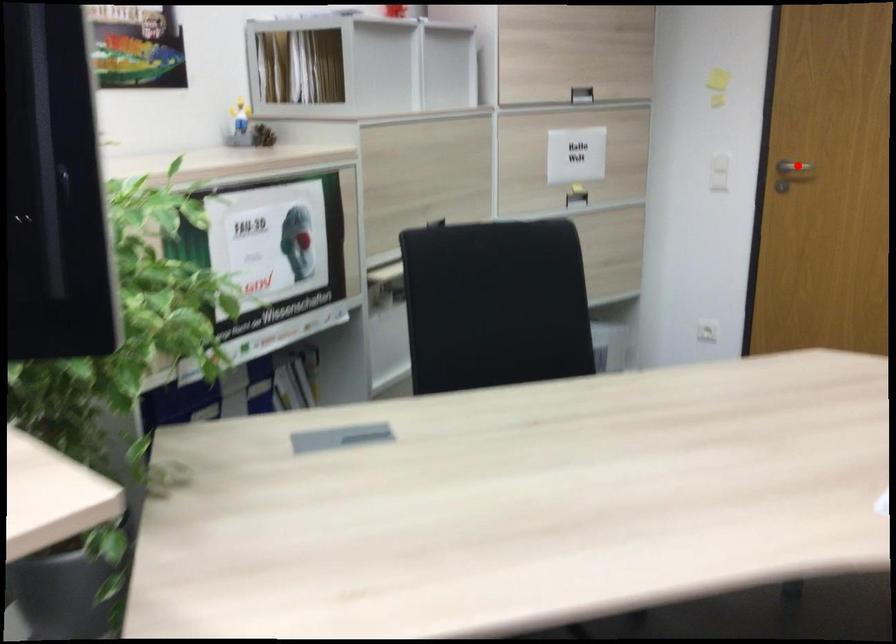
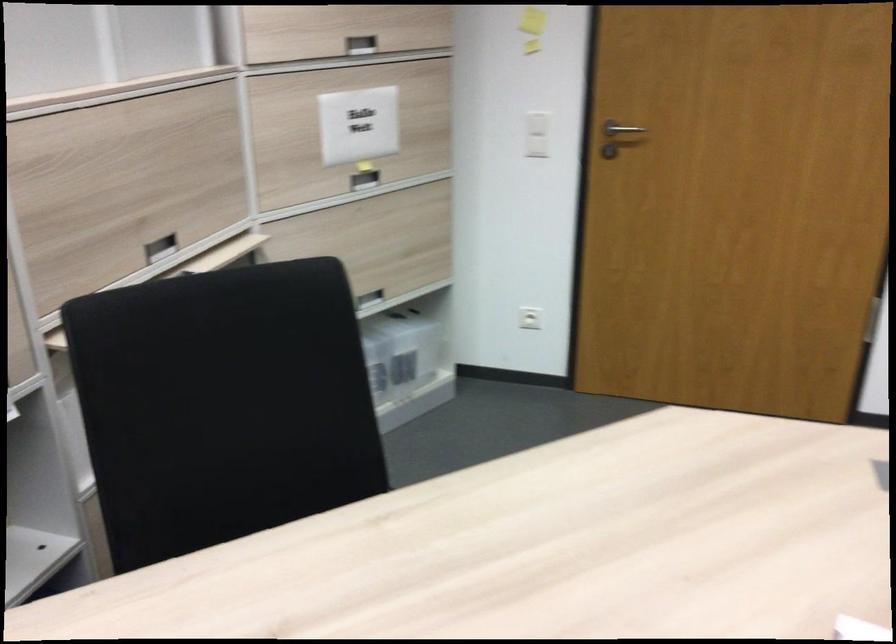
Question: I am providing you with two images of the same scene from different viewpoints. Given a red point in image1, look at the same physical point in image2. Is it:

Choices:
 (A) Closer to the viewpoint
 (B) Farther from the viewpoint

Answer: (A)